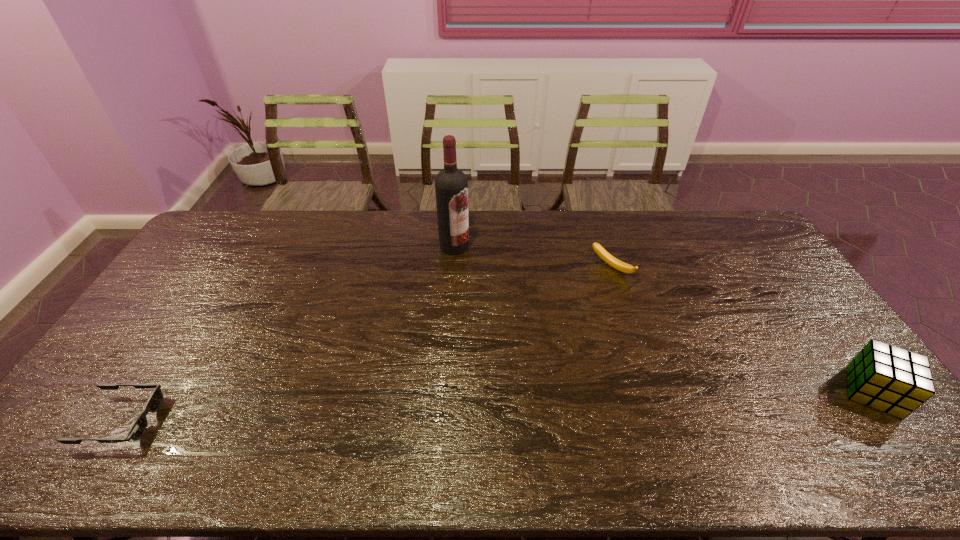
You are a GUI agent. You are given a task and a screenshot of the screen. Output one action in this format:
    pyautogui.click(x=<x>, y=<y>)
    Task: Click on the object located at the right edge
    The height and width of the screenshot is (540, 960).
    Given the screenshot: What is the action you would take?
    coord(887,378)

I want to click on object at the near left corner, so click(x=139, y=427).

Image resolution: width=960 pixels, height=540 pixels. In order to click on object that is positioned at the near right corner in this screenshot , I will do `click(887, 378)`.

This screenshot has width=960, height=540. I want to click on vacant area at the far edge, so click(x=596, y=219).

This screenshot has width=960, height=540. In the image, there is a desktop. What are the coordinates of `vacant space at the near edge` in the screenshot? It's located at (577, 423).

This screenshot has height=540, width=960. In the image, there is a desktop. What are the coordinates of `vacant area at the left edge` in the screenshot? It's located at (124, 380).

Find the location of a particular element. vacant space at the right edge is located at coordinates (800, 319).

In the image, there is a desktop. In order to click on vacant space at the far right corner in this screenshot , I will do `click(756, 244)`.

Locate an element on the screen. The width and height of the screenshot is (960, 540). blank region between the leftmost object and the second object from left to right is located at coordinates (288, 333).

Find the location of a particular element. Image resolution: width=960 pixels, height=540 pixels. vacant region between the shortest object and the tallest object is located at coordinates (288, 333).